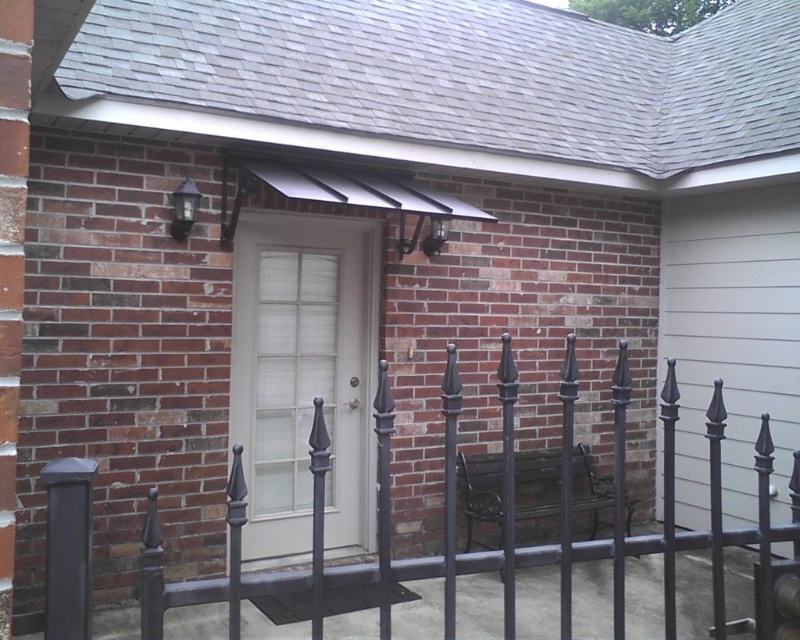
Question: Does black wrought iron fence at center have a larger size compared to white glass door at center?

Choices:
 (A) no
 (B) yes

Answer: (B)

Question: Does black wrought iron fence at center appear on the right side of white glass door at center?

Choices:
 (A) no
 (B) yes

Answer: (B)

Question: Which point is farther to the camera?

Choices:
 (A) black wrought iron fence at center
 (B) white glass door at center

Answer: (B)

Question: Among these points, which one is farthest from the camera?

Choices:
 (A) (348, 460)
 (B) (314, 483)

Answer: (A)

Question: Where is black wrought iron fence at center located in relation to white glass door at center in the image?

Choices:
 (A) left
 (B) right

Answer: (B)